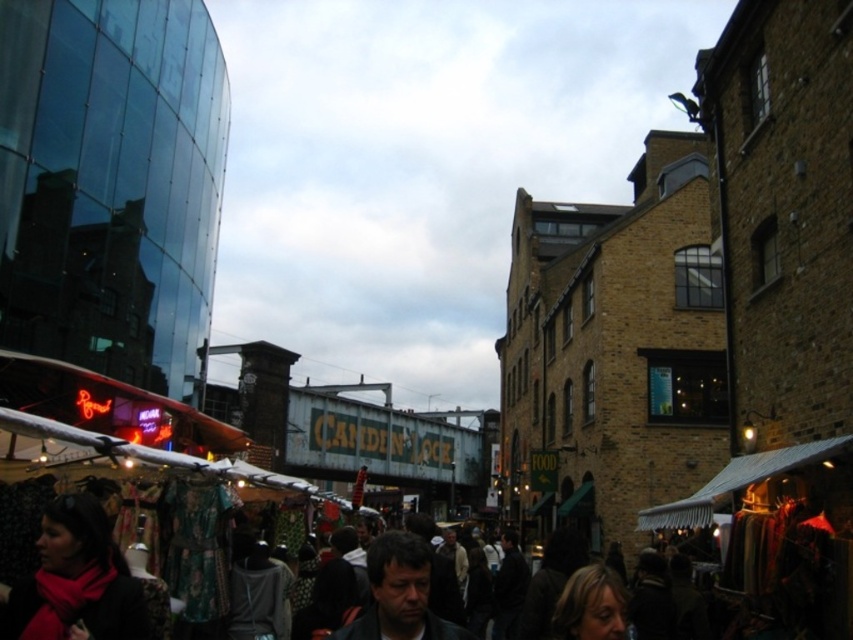
Question: Can you confirm if matte red scarf at lower left is bigger than dark brown hair at center?

Choices:
 (A) yes
 (B) no

Answer: (B)

Question: Considering the relative positions of matte red scarf at lower left and dark brown hair at center in the image provided, where is matte red scarf at lower left located with respect to dark brown hair at center?

Choices:
 (A) below
 (B) above

Answer: (B)

Question: Which object appears farthest from the camera in this image?

Choices:
 (A) matte red scarf at lower left
 (B) dark brown hair at center

Answer: (B)

Question: Does matte red scarf at lower left appear under dark brown hair at center?

Choices:
 (A) no
 (B) yes

Answer: (A)

Question: Which point is closer to the camera?

Choices:
 (A) matte red scarf at lower left
 (B) dark brown hair at center

Answer: (A)

Question: Which object appears closest to the camera in this image?

Choices:
 (A) dark brown hair at center
 (B) matte red scarf at lower left

Answer: (B)